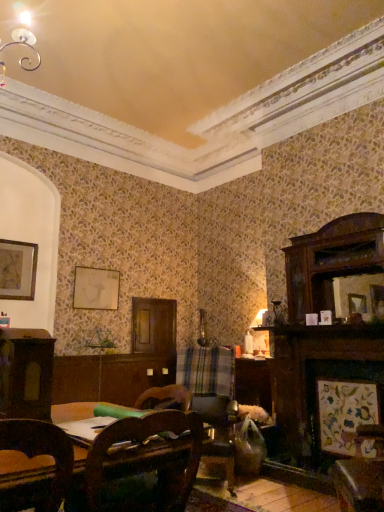
Question: Is point pos(380,318) closer or farther from the camera than point pos(337,406)?

Choices:
 (A) farther
 (B) closer

Answer: (A)

Question: From a real-world perspective, relative to wooden framed artwork at lower right, which ranks as the 4th picture frame in back-to-front order, is wooden picture frame at right, the 4th picture frame from the left, vertically above or below?

Choices:
 (A) below
 (B) above

Answer: (B)

Question: Which object is the farthest from the wooden picture frame at right, which appears as the third picture frame when viewed from the top?

Choices:
 (A) dark wood cabinet at left
 (B) matte white picture frame at upper center, the second picture frame in the left-to-right sequence
 (C) wooden framed artwork at upper left, the 4th picture frame when ordered from right to left
 (D) wooden chair at center
 (E) plaid fabric swivel chair at center

Answer: (C)

Question: Which is farther from the dark wood cabinet at left?

Choices:
 (A) wooden framed artwork at lower right, arranged as the 4th picture frame when viewed from the top
 (B) matte white picture frame at upper center, the third picture frame viewed from the right
 (C) wooden picture frame at right, which is counted as the second picture frame, starting from the front
 (D) plaid fabric swivel chair at center
 (E) wooden chair at center

Answer: (B)